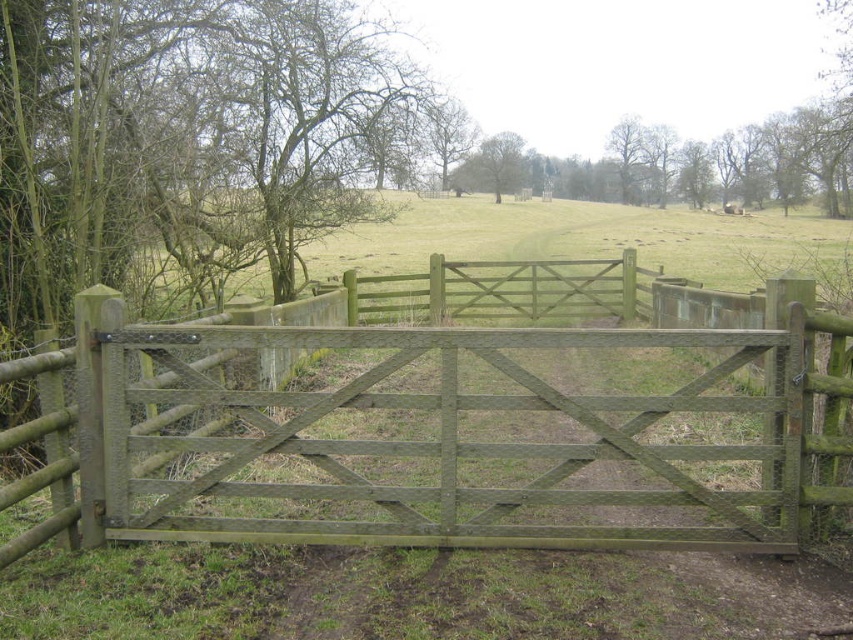
Is point (71, 493) more distant than point (476, 164)?

No, it is in front of (476, 164).

Is point (502, 500) positioned in front of point (495, 202)?

Yes, it is in front of point (495, 202).

Where is `green wood gate at center`? Image resolution: width=853 pixels, height=640 pixels. green wood gate at center is located at coordinates (434, 410).

Which is above, green wood gate at center or smooth brown tree at upper center?

smooth brown tree at upper center is higher up.

Does green wood gate at center have a greater height compared to smooth brown tree at upper center?

In fact, green wood gate at center may be shorter than smooth brown tree at upper center.

Between point (735, 342) and point (450, 108), which one is positioned behind?

The point (450, 108) is more distant.

You are a GUI agent. You are given a task and a screenshot of the screen. Output one action in this format:
    pyautogui.click(x=<x>, y=<y>)
    Task: Click on the green wood gate at center
    This screenshot has height=640, width=853.
    Given the screenshot: What is the action you would take?
    pyautogui.click(x=434, y=410)

Which is above, smooth brown tree at upper center or smooth brown tree at center?

smooth brown tree at center

In order to click on smooth brown tree at upper center in this screenshot , I will do `click(447, 136)`.